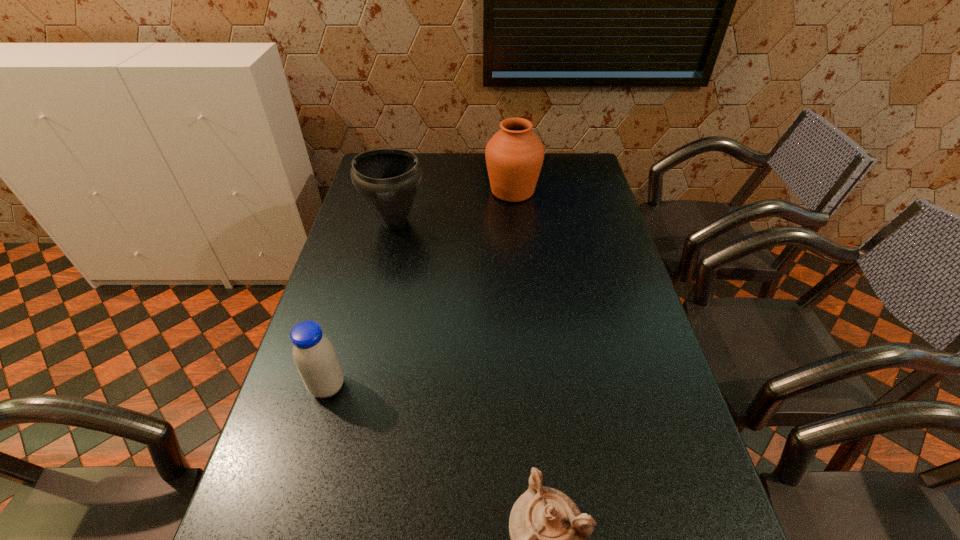
At what (x,y) coordinates should I click in order to perform the action: click on free space at the far right corner of the desktop. Please return your answer as a coordinate pair (x, y). Looking at the image, I should click on (571, 177).

Image resolution: width=960 pixels, height=540 pixels. I want to click on vacant space that's between the leftmost urn and the second nearest object, so click(x=361, y=304).

Identify the location of free spot between the third farthest object and the leftmost urn. The image size is (960, 540). (361, 304).

The image size is (960, 540). Find the location of `vacant point located between the leftmost urn and the second nearest object`. vacant point located between the leftmost urn and the second nearest object is located at coordinates (361, 304).

Locate an element on the screen. Image resolution: width=960 pixels, height=540 pixels. object identified as the third closest to the nearest urn is located at coordinates (514, 155).

Locate which object ranks in proximity to the soya milk. Please provide its 2D coordinates. Your answer should be formatted as a tuple, i.e. [(x, y)], where the tuple contains the x and y coordinates of a point satisfying the conditions above.

[(548, 533)]

Image resolution: width=960 pixels, height=540 pixels. Find the location of `urn that is the second closest to the leftmost urn`. urn that is the second closest to the leftmost urn is located at coordinates (548, 533).

This screenshot has width=960, height=540. In order to click on urn that is the closest to the shortest urn in this screenshot , I will do `click(388, 180)`.